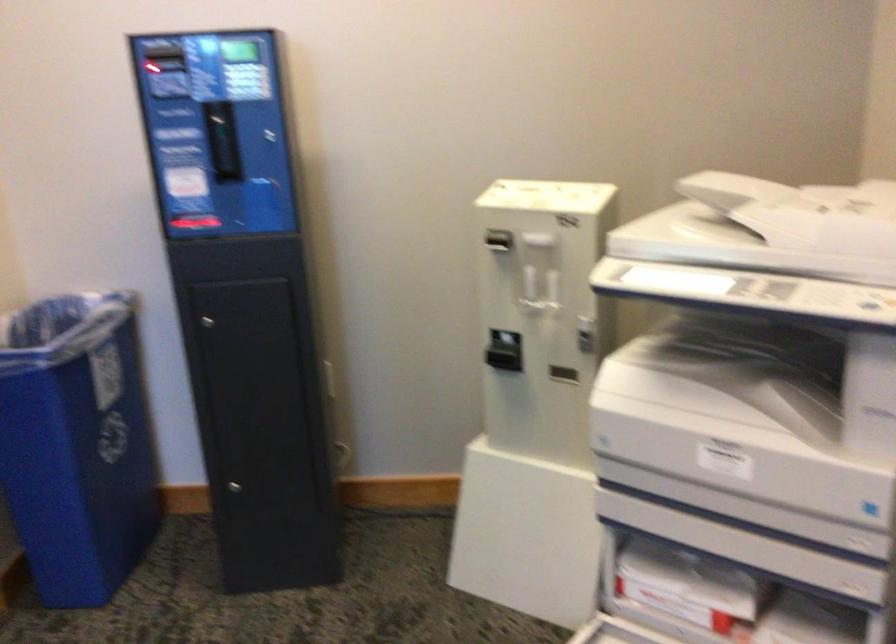
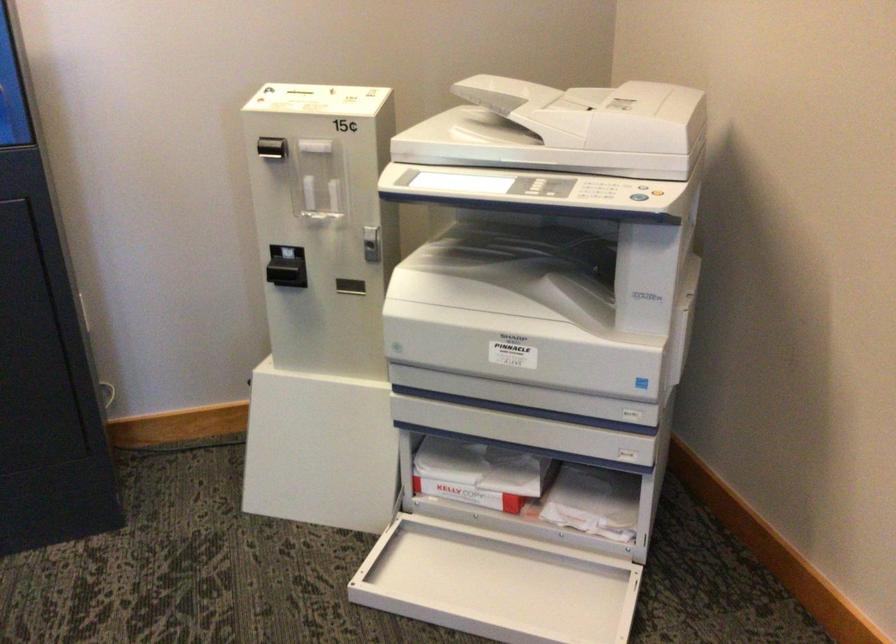
The point at (x=496, y=241) is marked in the first image. Where is the corresponding point in the second image?

(271, 147)